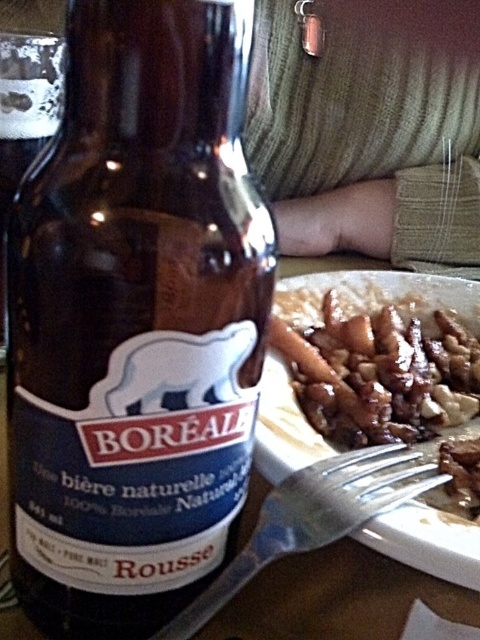
Who is more forward, (216, 189) or (304, 513)?

Point (216, 189) is in front.

In the scene shown: Does brown glass bottle at center have a smaller size compared to silver metallic fork at lower center?

No, brown glass bottle at center is not smaller than silver metallic fork at lower center.

What do you see at coordinates (135, 320) in the screenshot? The image size is (480, 640). I see `brown glass bottle at center` at bounding box center [135, 320].

The width and height of the screenshot is (480, 640). In order to click on brown glass bottle at center in this screenshot , I will do `click(135, 320)`.

Which is in front, point (141, 492) or point (287, 317)?

Point (141, 492) is more forward.

Can you confirm if brown glass bottle at center is shorter than brown glossy pecans at plate center?

No, brown glass bottle at center is not shorter than brown glossy pecans at plate center.

Who is more forward, [118,243] or [304,372]?

Positioned in front is point [118,243].

Locate an element on the screen. This screenshot has height=640, width=480. brown glass bottle at center is located at coordinates (135, 320).

Which is below, brown glossy pecans at plate center or silver metallic fork at lower center?

silver metallic fork at lower center is below.

Is point (330, 317) closer to camera compared to point (298, 477)?

No.

Identify the location of brown glossy pecans at plate center. The width and height of the screenshot is (480, 640). (376, 365).